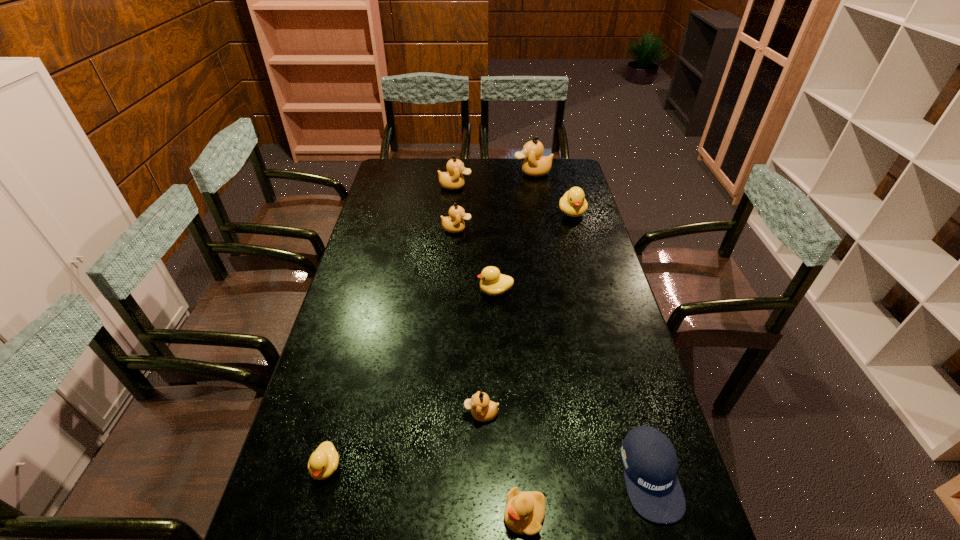
This screenshot has height=540, width=960. I want to click on the farthest object, so click(x=535, y=164).

What are the coordinates of `the farthest tan duckling` in the screenshot? It's located at (535, 164).

Find the location of `the seventh nearest duckling`. the seventh nearest duckling is located at coordinates (453, 179).

Where is `the eighth shortest object`? This screenshot has height=540, width=960. the eighth shortest object is located at coordinates (453, 179).

The height and width of the screenshot is (540, 960). What are the coordinates of `the farthest yellow duckling` in the screenshot? It's located at (573, 203).

Find the location of a particular element. the rightmost yellow duckling is located at coordinates (573, 203).

Where is `the second smallest tan duckling`? This screenshot has width=960, height=540. the second smallest tan duckling is located at coordinates click(454, 223).

Locate an element on the screen. This screenshot has height=540, width=960. the fifth farthest duckling is located at coordinates (492, 282).

What are the coordinates of `the fifth nearest object` in the screenshot? It's located at (492, 282).

The height and width of the screenshot is (540, 960). I want to click on the third nearest duckling, so click(x=483, y=409).